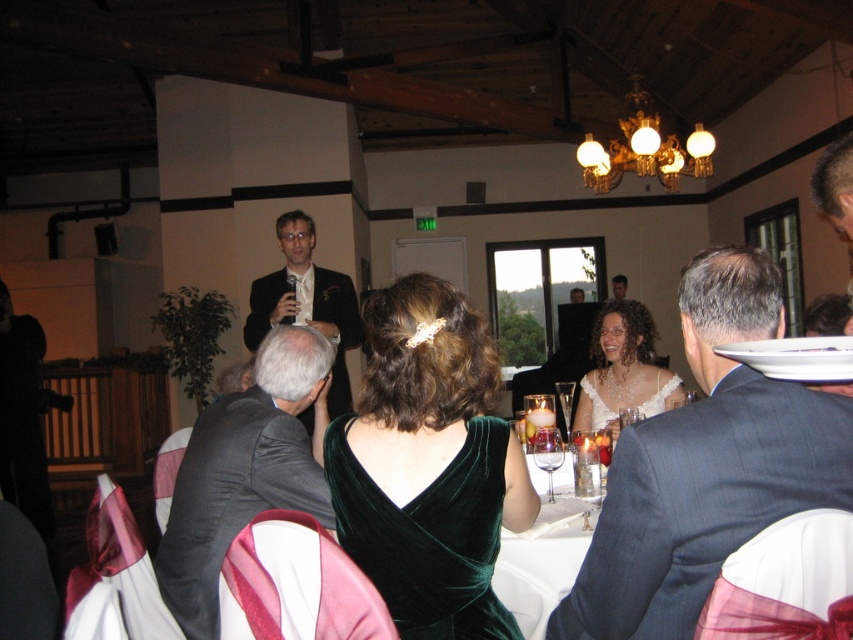
Between gray hair at upper right and matte black suit at upper center, which one has less height?

With less height is gray hair at upper right.

Is gray hair at upper right wider than matte black suit at upper center?

No, gray hair at upper right is not wider than matte black suit at upper center.

Does point (830, 180) lie behind point (612, 280)?

No, (830, 180) is closer to viewer.

At what (x,y) coordinates should I click in order to perform the action: click on gray hair at upper right. Please return your answer as a coordinate pair (x, y). Looking at the image, I should click on (834, 186).

Can you confirm if dark gray suit at center is positioned below clear glass wine glass at center?

Actually, dark gray suit at center is above clear glass wine glass at center.

Does point (213, 531) come in front of point (566, 428)?

Yes, point (213, 531) is in front of point (566, 428).

The width and height of the screenshot is (853, 640). Find the location of `dark gray suit at center`. dark gray suit at center is located at coordinates (245, 470).

Is dark blue suit at center closer to the viewer compared to clear glass wine glass at center?

Yes, dark blue suit at center is closer to the viewer.

Who is more distant from viewer, (625, 502) or (572, 396)?

The point (572, 396) is behind.

The height and width of the screenshot is (640, 853). I want to click on dark blue suit at center, so click(706, 465).